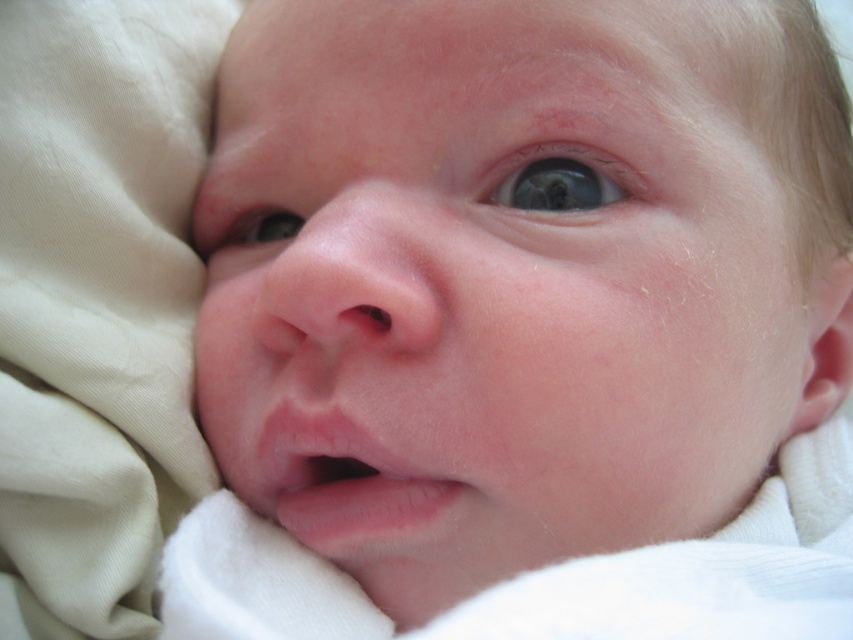
Is smooth skin face at center further to the viewer compared to blue smooth eye at center?

No, smooth skin face at center is in front of blue smooth eye at center.

Which is more to the left, smooth skin face at center or blue smooth eye at center?

From the viewer's perspective, blue smooth eye at center appears more on the left side.

Find the location of a particular element. smooth skin face at center is located at coordinates pyautogui.click(x=494, y=285).

Between blue glossy eye at upper center and blue smooth eye at center, which one appears on the right side from the viewer's perspective?

Positioned to the right is blue glossy eye at upper center.

Who is taller, blue glossy eye at upper center or blue smooth eye at center?

With more height is blue glossy eye at upper center.

Locate an element on the screen. blue glossy eye at upper center is located at coordinates (561, 179).

Where is `blue glossy eye at upper center`? blue glossy eye at upper center is located at coordinates (561, 179).

Which is above, smooth skin face at center or blue glossy eye at upper center?

Positioned higher is blue glossy eye at upper center.

Describe the element at coordinates (494, 285) in the screenshot. This screenshot has height=640, width=853. I see `smooth skin face at center` at that location.

At what (x,y) coordinates should I click in order to perform the action: click on smooth skin face at center. Please return your answer as a coordinate pair (x, y). The image size is (853, 640). Looking at the image, I should click on (494, 285).